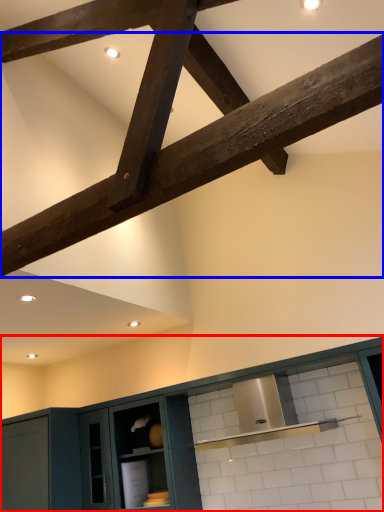
Question: Among these objects, which one is farthest to the camera, cabinetry (highlighted by a red box) or beam (highlighted by a blue box)?

Choices:
 (A) cabinetry
 (B) beam

Answer: (A)